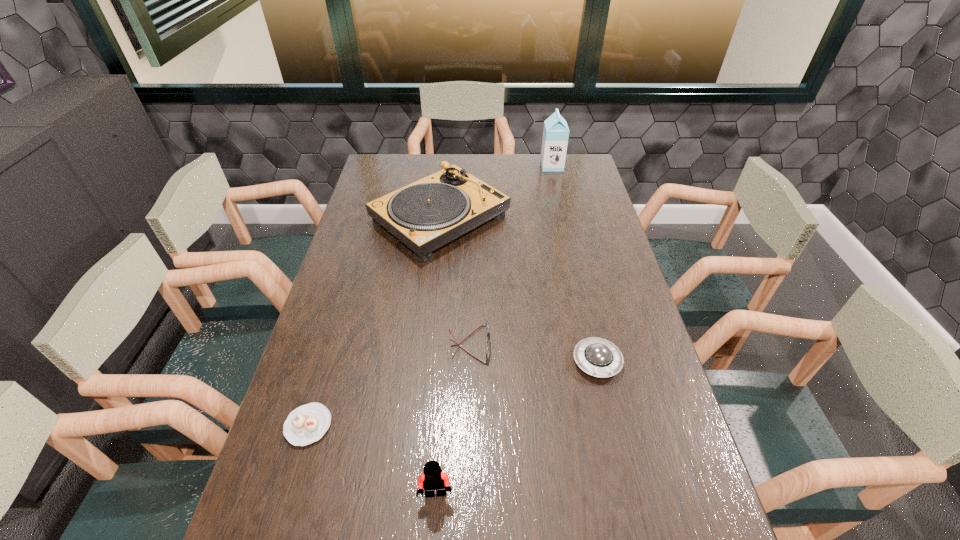
I want to click on milk carton, so click(556, 132).

Locate an element on the screen. the farthest object is located at coordinates (556, 132).

Identify the location of record player. (429, 213).

Locate an element on the screen. The width and height of the screenshot is (960, 540). the nearest object is located at coordinates (433, 478).

I want to click on saucer, so click(x=598, y=357).

This screenshot has height=540, width=960. I want to click on the fifth farthest object, so click(x=306, y=424).

Where is `spectacles`? The image size is (960, 540). spectacles is located at coordinates (486, 322).

Locate an element on the screen. Image resolution: width=960 pixels, height=540 pixels. free space located 0.110m on the right of the milk carton is located at coordinates (588, 166).

Where is `free region located 0.290m on the right of the record player`? This screenshot has height=540, width=960. free region located 0.290m on the right of the record player is located at coordinates (589, 219).

What are the coordinates of `free space located 0.050m on the back of the saucer` in the screenshot? It's located at (589, 328).